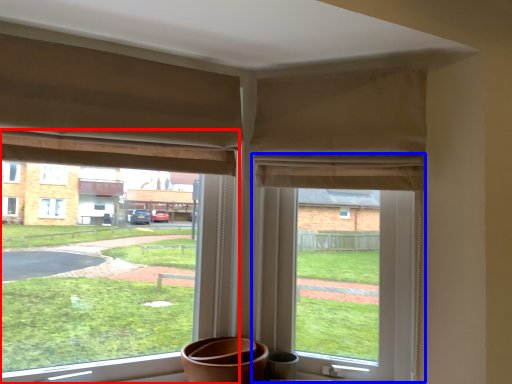
Question: Among these objects, which one is nearest to the camera, window (highlighted by a red box) or window screen (highlighted by a blue box)?

Choices:
 (A) window
 (B) window screen

Answer: (A)